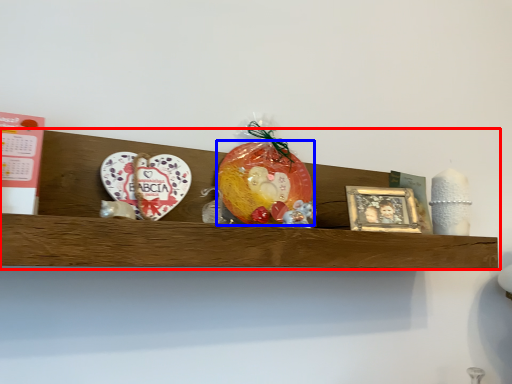
Question: Among these objects, which one is nearest to the camera, shelf (highlighted by a red box) or fruit (highlighted by a blue box)?

Choices:
 (A) shelf
 (B) fruit

Answer: (A)